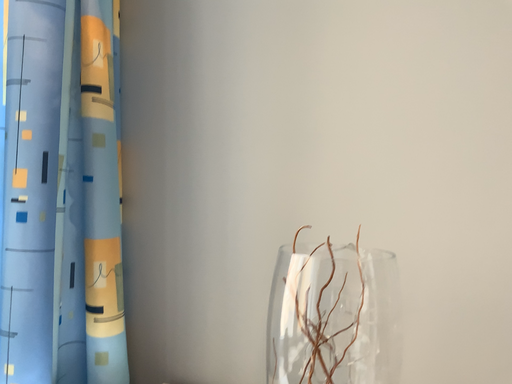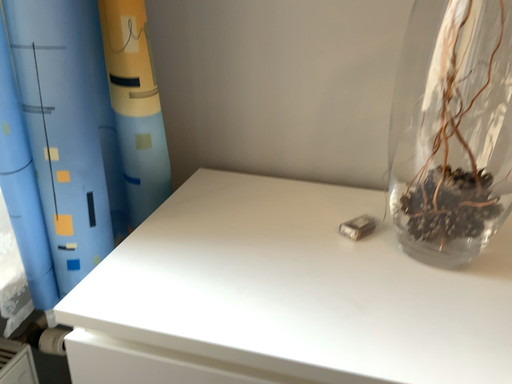
Question: How did the camera likely rotate when shooting the video?

Choices:
 (A) rotated downward
 (B) rotated upward

Answer: (A)